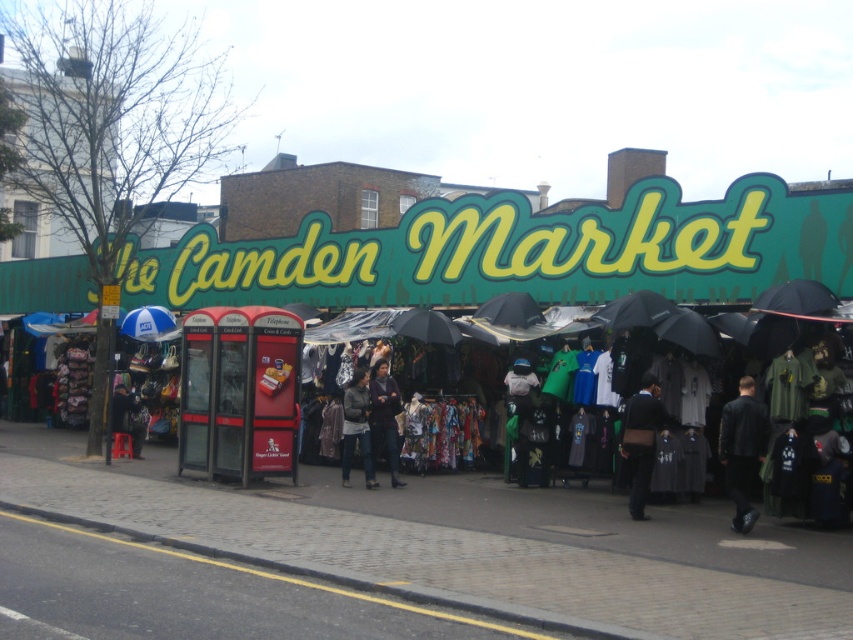
You are a photographer standing at the edge of the cobblestone street at Camden Market. You see a black leather jacket at lower right and a camera somewhere in the scene. Which object is closer to you?

The black leather jacket at lower right is closer to you since it is only 32.84 feet away from the camera.

You are standing at the Camden Market and see the black matte umbrella at center. If you want to reach it quickly, should you walk towards it or is it too far?

The black matte umbrella at center is 14.32 meters away from you, so you can comfortably walk towards it to reach it quickly.

You are standing at the center of Camden Market and want to find the black matte umbrella at center. According to the coordinates given, where exactly should you look to find it?

The black matte umbrella at center is located at the coordinates point (426, 326).